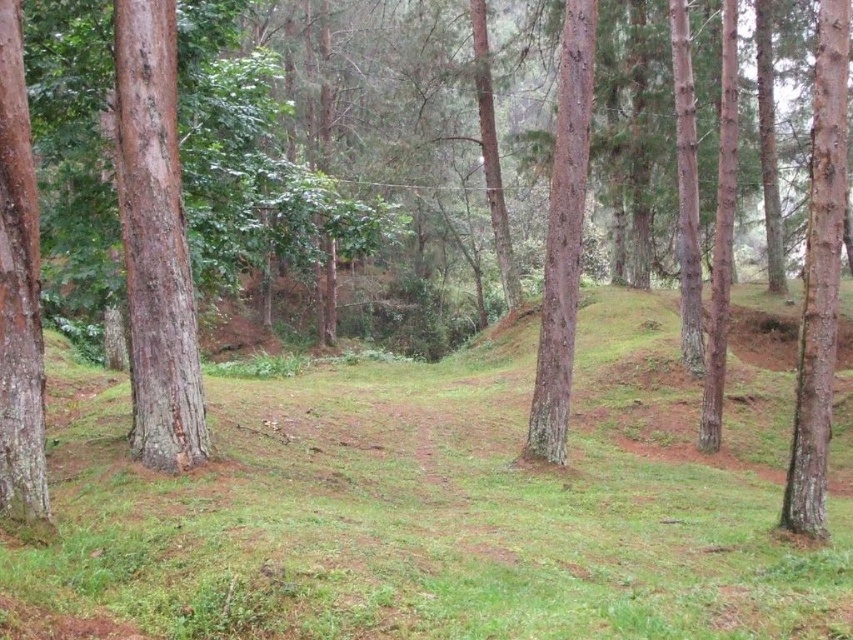
Question: Is brown rough bark tree at left to the left of smooth brown tree trunk at center from the viewer's perspective?

Choices:
 (A) no
 (B) yes

Answer: (B)

Question: Which point is closer to the camera?

Choices:
 (A) green grassy at center
 (B) smooth brown tree trunk at center

Answer: (A)

Question: Considering the real-world distances, which object is closest to the smooth bark tree at right?

Choices:
 (A) smooth brown tree trunk at left
 (B) brown rough bark tree at left

Answer: (B)

Question: Is smooth bark tree at right smaller than smooth brown tree trunk at center?

Choices:
 (A) no
 (B) yes

Answer: (A)

Question: Which object is positioned closest to the smooth brown tree trunk at center?

Choices:
 (A) smooth brown tree trunk at left
 (B) brown rough bark tree at left
 (C) green grassy at center

Answer: (C)

Question: Does smooth brown tree trunk at left lie behind smooth brown tree trunk at center?

Choices:
 (A) yes
 (B) no

Answer: (B)